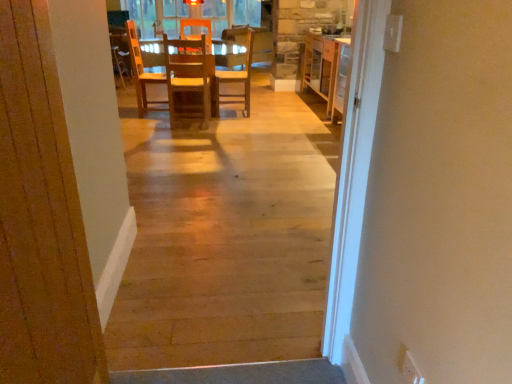
Identify the location of vacant area that is situated to the right of wooden chair at center, positioned as the 2th chair in left-to-right order. This screenshot has width=512, height=384. (267, 107).